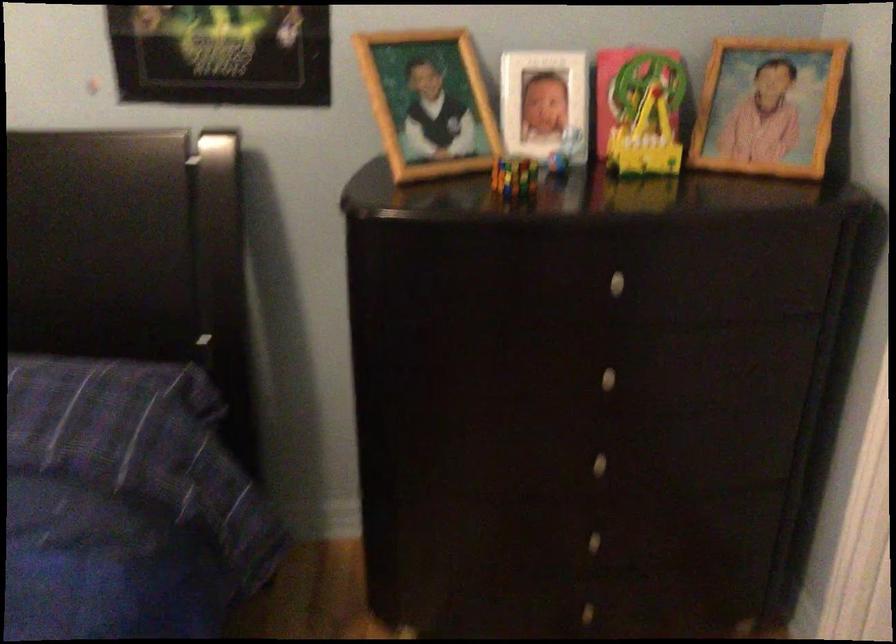
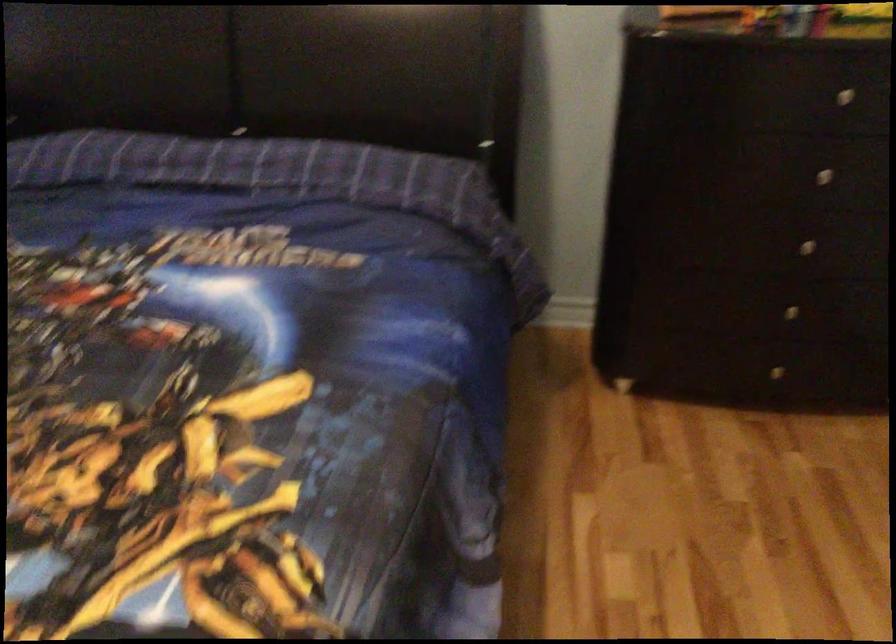
Find the pixel in the second image that matches point 604,535 in the first image.

(790, 310)